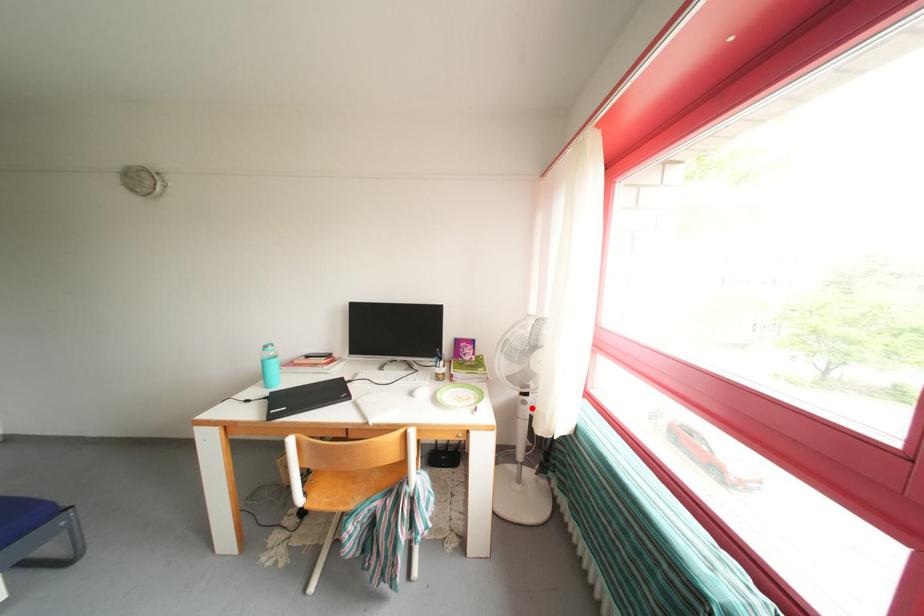
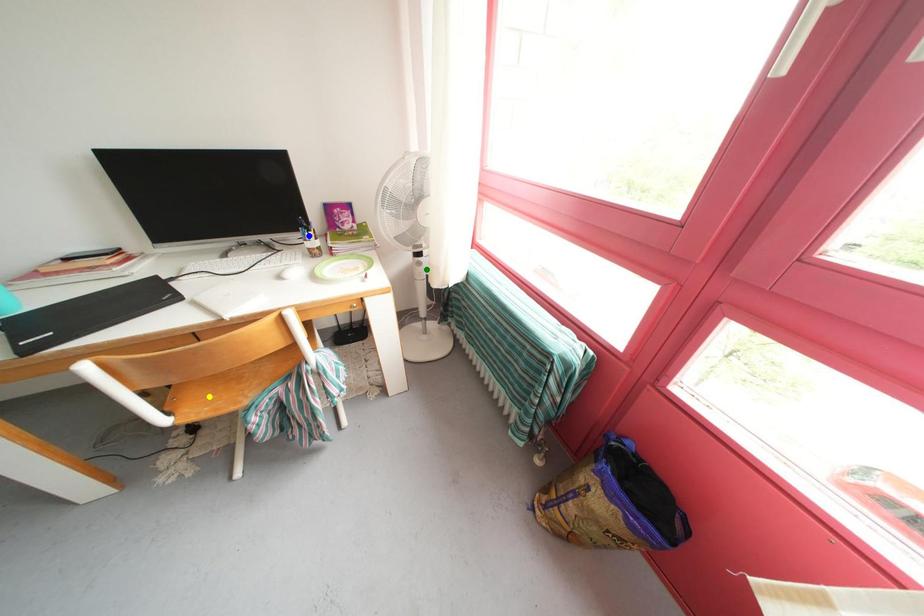
Question: I am providing you with two images of the same scene from different viewpoints. A red point is marked on the first image. You are given multiple points on the second image. Which point in image 2 represents the same 3d spot as the red point in image 1?

Choices:
 (A) blue point
 (B) green point
 (C) yellow point

Answer: (B)